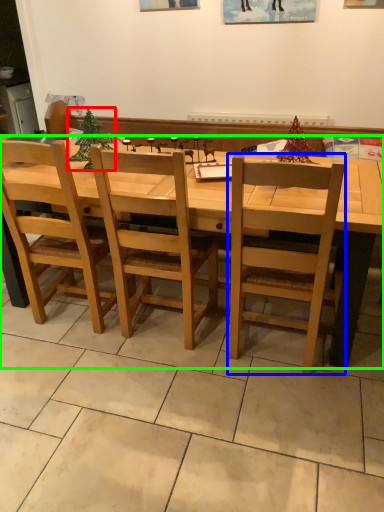
Question: Based on their relative distances, which object is nearer to christmas tree (highlighted by a red box)? Choose from chair (highlighted by a blue box) and desk (highlighted by a green box).

Choices:
 (A) chair
 (B) desk

Answer: (B)